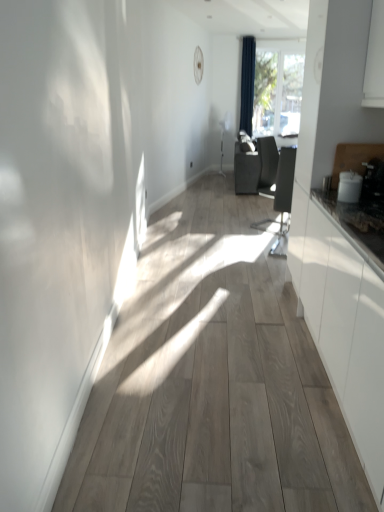
Question: From the image's perspective, is dark blue fabric curtain at upper center positioned above or below transparent glass window at upper center?

Choices:
 (A) above
 (B) below

Answer: (B)

Question: From a real-world perspective, is dark blue fabric curtain at upper center positioned above or below transparent glass window at upper center?

Choices:
 (A) below
 (B) above

Answer: (B)

Question: Which is nearer to the matte black swivel chair at center?

Choices:
 (A) dark blue fabric curtain at upper center
 (B) transparent glass window at upper center

Answer: (A)

Question: Which is farther from the dark blue fabric curtain at upper center?

Choices:
 (A) transparent glass window at upper center
 (B) matte black swivel chair at center

Answer: (B)